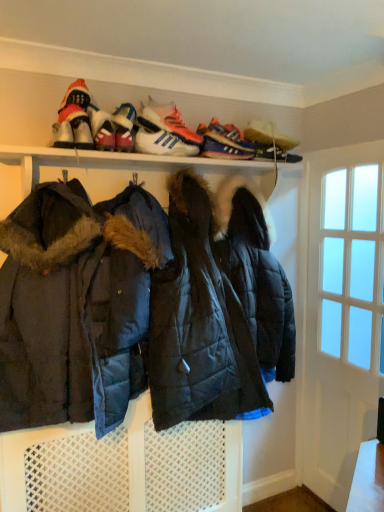
What do you see at coordinates (63, 135) in the screenshot? The width and height of the screenshot is (384, 512). I see `white leather sneaker at upper left, acting as the second shoe starting from the back` at bounding box center [63, 135].

What do you see at coordinates (227, 146) in the screenshot?
I see `purple suede sneaker at upper center, which ranks as the 2th shoe in front-to-back order` at bounding box center [227, 146].

The image size is (384, 512). I want to click on white leather sneakers at upper center, which ranks as the fourth footwear in left-to-right order, so [x=164, y=131].

Where is `shiny pink sneaker at upper center, acting as the second footwear starting from the left`? Image resolution: width=384 pixels, height=512 pixels. shiny pink sneaker at upper center, acting as the second footwear starting from the left is located at coordinates (124, 127).

Where is `white leather sneaker at upper left, the 1th shoe viewed from the front`? white leather sneaker at upper left, the 1th shoe viewed from the front is located at coordinates (63, 135).

Does white glass door at right come in front of white leather sneakers at upper center, which ranks as the fourth footwear in left-to-right order?

That is False.

How different are the orientations of white glass door at right and white leather sneakers at upper center, which ranks as the fourth footwear in left-to-right order, in degrees?

87.2 degrees.

Is white leather sneakers at upper center, which ranks as the fourth footwear in left-to-right order, at the back of white glass door at right?

white glass door at right does not have its back to white leather sneakers at upper center, which ranks as the fourth footwear in left-to-right order.

Looking at this image, can you confirm if white glass door at right is thinner than white leather sneakers at upper center, acting as the second footwear starting from the right?

Yes, white glass door at right is thinner than white leather sneakers at upper center, acting as the second footwear starting from the right.

From the image's perspective, relative to white leather sneaker at upper left, the 1th shoe viewed from the front, is dark blue quilted jacket at center above or below?

From the image's perspective, dark blue quilted jacket at center appears below white leather sneaker at upper left, the 1th shoe viewed from the front.

Could you tell me if dark blue quilted jacket at center is facing white leather sneaker at upper left, acting as the second shoe starting from the back?

No, dark blue quilted jacket at center is not turned towards white leather sneaker at upper left, acting as the second shoe starting from the back.

From the picture: Is dark blue quilted jacket at center next to white leather sneaker at upper left, the 1th shoe viewed from the front?

No, dark blue quilted jacket at center is not making contact with white leather sneaker at upper left, the 1th shoe viewed from the front.

I want to click on jacket below the white leather sneaker at upper left, which is counted as the 1th shoe, starting from the left (from the image's perspective), so click(x=141, y=306).

Which of these two, white glass door at right or dark blue quilted jacket at center, is thinner?

With smaller width is white glass door at right.

This screenshot has height=512, width=384. Identify the location of door on the right of dark blue quilted jacket at center. (343, 318).

Is white glass door at right bigger than dark blue quilted jacket at center?

Actually, white glass door at right might be smaller than dark blue quilted jacket at center.

Which object is more forward, white glass door at right or dark blue quilted jacket at center?

dark blue quilted jacket at center is more forward.

Can you tell me how much white leather sneakers at upper center, the third footwear positioned from the right, and white glass door at right differ in facing direction?

87.2 degrees.

Can you confirm if white leather sneakers at upper center, the third footwear positioned from the right, is positioned to the right of white glass door at right?

No, white leather sneakers at upper center, the third footwear positioned from the right, is not to the right of white glass door at right.

In the scene shown: In the image, is white leather sneakers at upper center, the third footwear positioned from the right, positioned in front of or behind white glass door at right?

Clearly, white leather sneakers at upper center, the third footwear positioned from the right, is in front of white glass door at right.

Would you consider velvet-like red boot at upper left, the 1th footwear when ordered from left to right, to be distant from white leather sneaker at upper left, which is counted as the 1th shoe, starting from the left?

No, velvet-like red boot at upper left, the 1th footwear when ordered from left to right, is not far from white leather sneaker at upper left, which is counted as the 1th shoe, starting from the left.

From the image's perspective, is velvet-like red boot at upper left, the fifth footwear from the right, on top of white leather sneaker at upper left, the 1th shoe viewed from the front?

Yes, from the image's perspective, velvet-like red boot at upper left, the fifth footwear from the right, is over white leather sneaker at upper left, the 1th shoe viewed from the front.

Is velvet-like red boot at upper left, the fifth footwear from the right, in front of or behind white leather sneaker at upper left, the 1th shoe viewed from the front, in the image?

velvet-like red boot at upper left, the fifth footwear from the right, is positioned closer to the viewer than white leather sneaker at upper left, the 1th shoe viewed from the front.

Considering the relative sizes of velvet-like red boot at upper left, the 1th footwear when ordered from left to right, and white leather sneaker at upper left, acting as the second shoe starting from the back, in the image provided, is velvet-like red boot at upper left, the 1th footwear when ordered from left to right, bigger than white leather sneaker at upper left, acting as the second shoe starting from the back,?

Yes.

Are shiny black shoe at upper right, the fifth footwear when ordered from left to right, and purple suede sneaker at upper center, arranged as the 1th shoe when viewed from the right, located far from each other?

No.

Could you tell me if shiny black shoe at upper right, the fifth footwear when ordered from left to right, is facing purple suede sneaker at upper center, the second shoe positioned from the left?

No, shiny black shoe at upper right, the fifth footwear when ordered from left to right, is not turned towards purple suede sneaker at upper center, the second shoe positioned from the left.

From the image's perspective, which object appears higher, shiny black shoe at upper right, which appears as the first footwear when viewed from the right, or purple suede sneaker at upper center, arranged as the 1th shoe when viewed from the right?

shiny black shoe at upper right, which appears as the first footwear when viewed from the right, appears higher in the image.

Considering the positions of objects shiny black shoe at upper right, the fifth footwear when ordered from left to right, and purple suede sneaker at upper center, arranged as the 1th shoe when viewed from the right, in the image provided, who is behind, shiny black shoe at upper right, the fifth footwear when ordered from left to right, or purple suede sneaker at upper center, arranged as the 1th shoe when viewed from the right,?

shiny black shoe at upper right, the fifth footwear when ordered from left to right, is more distant.

From the image's perspective, which is above, white leather sneakers at upper center, acting as the second footwear starting from the right, or velvet-like red boot at upper left, the fifth footwear from the right?

velvet-like red boot at upper left, the fifth footwear from the right, from the image's perspective.

From their relative heights in the image, would you say white leather sneakers at upper center, acting as the second footwear starting from the right, is taller or shorter than velvet-like red boot at upper left, the fifth footwear from the right?

Considering their sizes, white leather sneakers at upper center, acting as the second footwear starting from the right, has more height than velvet-like red boot at upper left, the fifth footwear from the right.

Between white leather sneakers at upper center, acting as the second footwear starting from the right, and velvet-like red boot at upper left, the fifth footwear from the right, which one has smaller width?

white leather sneakers at upper center, acting as the second footwear starting from the right.

Is velvet-like red boot at upper left, the fifth footwear from the right, a part of white leather sneakers at upper center, acting as the second footwear starting from the right?

No, velvet-like red boot at upper left, the fifth footwear from the right, is not surrounded by white leather sneakers at upper center, acting as the second footwear starting from the right.

Locate an element on the screen. The width and height of the screenshot is (384, 512). door to the right of white leather sneakers at upper center, which ranks as the fourth footwear in left-to-right order is located at coordinates (343, 318).

In the image, there is a white leather sneaker at upper left, which is counted as the 1th shoe, starting from the left. What are the coordinates of `jacket below it (from the image's perspective)` in the screenshot? It's located at (141, 306).

From the image, which object appears to be nearer to shiny pink sneaker at upper center, which is the 4th footwear from right to left, white glass door at right or shiny black shoe at upper right, the fifth footwear when ordered from left to right?

shiny black shoe at upper right, the fifth footwear when ordered from left to right, is closer to shiny pink sneaker at upper center, which is the 4th footwear from right to left.

From the image, which object appears to be farther from dark blue quilted jacket at center, shiny black shoe at upper right, the fifth footwear when ordered from left to right, or white leather sneakers at upper center, the 3th footwear in the left-to-right sequence?

shiny black shoe at upper right, the fifth footwear when ordered from left to right, lies further to dark blue quilted jacket at center than the other object.

When comparing their distances from purple suede sneaker at upper center, the second shoe positioned from the left, does white leather sneakers at upper center, the 3th footwear in the left-to-right sequence, or shiny pink sneaker at upper center, acting as the second footwear starting from the left, seem closer?

white leather sneakers at upper center, the 3th footwear in the left-to-right sequence.

Consider the image. Which object lies nearer to the anchor point white leather sneakers at upper center, the 3th footwear in the left-to-right sequence, velvet-like red boot at upper left, the 1th footwear when ordered from left to right, or shiny pink sneaker at upper center, which is the 4th footwear from right to left?

Based on the image, shiny pink sneaker at upper center, which is the 4th footwear from right to left, appears to be nearer to white leather sneakers at upper center, the 3th footwear in the left-to-right sequence.

Which object lies nearer to the anchor point white glass door at right, purple suede sneaker at upper center, the second shoe positioned from the left, or white leather sneaker at upper left, the 1th shoe viewed from the front?

Among the two, purple suede sneaker at upper center, the second shoe positioned from the left, is located nearer to white glass door at right.

From the image, which object appears to be nearer to shiny black shoe at upper right, the fifth footwear when ordered from left to right, white leather sneakers at upper center, which ranks as the fourth footwear in left-to-right order, or purple suede sneaker at upper center, the second shoe positioned from the left?

purple suede sneaker at upper center, the second shoe positioned from the left, lies closer to shiny black shoe at upper right, the fifth footwear when ordered from left to right, than the other object.

From the image, which object appears to be nearer to dark blue quilted jacket at center, shiny black shoe at upper right, which appears as the first footwear when viewed from the right, or white leather sneakers at upper center, which ranks as the fourth footwear in left-to-right order?

white leather sneakers at upper center, which ranks as the fourth footwear in left-to-right order, is closer to dark blue quilted jacket at center.

Estimate the real-world distances between objects in this image. Which object is further from shiny black shoe at upper right, which appears as the first footwear when viewed from the right, white glass door at right or white leather sneaker at upper left, which is counted as the 1th shoe, starting from the left?

The object further to shiny black shoe at upper right, which appears as the first footwear when viewed from the right, is white leather sneaker at upper left, which is counted as the 1th shoe, starting from the left.

Where is `shoe between shiny pink sneaker at upper center, acting as the second footwear starting from the left, and dark blue quilted jacket at center vertically`? shoe between shiny pink sneaker at upper center, acting as the second footwear starting from the left, and dark blue quilted jacket at center vertically is located at coordinates (63, 135).

Find the location of a particular element. jacket between velvet-like red boot at upper left, the fifth footwear from the right, and shiny black shoe at upper right, the fifth footwear when ordered from left to right, in the horizontal direction is located at coordinates (141, 306).

The image size is (384, 512). I want to click on footwear between shiny pink sneaker at upper center, which is the 4th footwear from right to left, and white leather sneakers at upper center, which ranks as the fourth footwear in left-to-right order, in the horizontal direction, so click(165, 143).

Where is `shoe between white leather sneaker at upper left, which is counted as the 1th shoe, starting from the left, and shiny black shoe at upper right, which appears as the first footwear when viewed from the right, in the horizontal direction`? shoe between white leather sneaker at upper left, which is counted as the 1th shoe, starting from the left, and shiny black shoe at upper right, which appears as the first footwear when viewed from the right, in the horizontal direction is located at coordinates (227, 146).